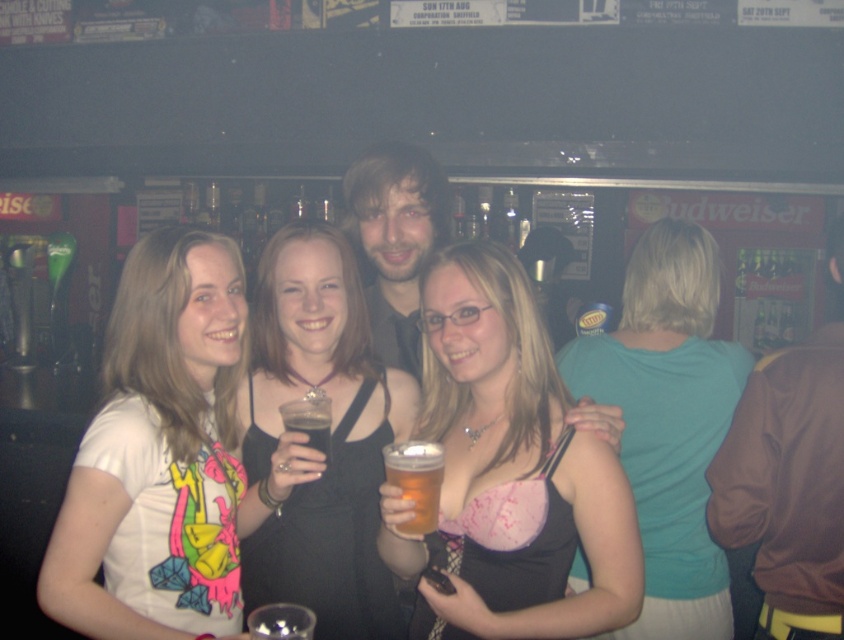
You are a photographer standing at the back of the bar. You want to take a closeup shot of the pink satin dress at center. The camera you have can focus on subjects within 2 meters. Do you need to move closer to the dress to take the photo?

The pink satin dress at center is 2.66 meters away from the camera. Since the camera can only focus on subjects within 2 meters, you need to move closer to the dress to take the photo.